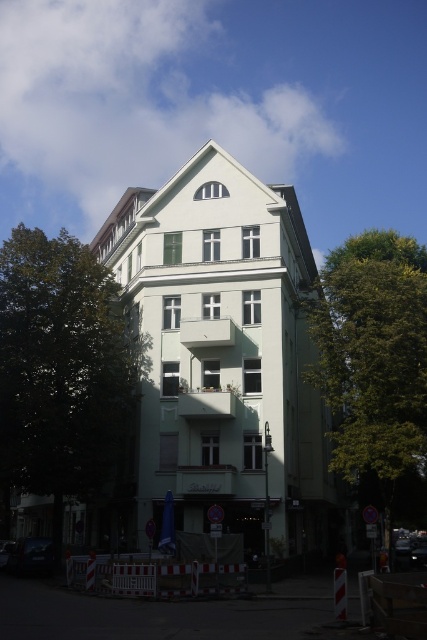
A worker needs to move a ladder from the green leafy tree at left to the construction area marked by red and white barriers. The ladder is 5 meters long. Will the ladder reach the construction area from the tree?

The distance between the green leafy tree at left and the construction area marked by red and white barriers is 56.73 meters. Since the ladder is only 5 meters long, it will not be long enough to reach the construction area from the tree.

You are a delivery person with a 1.5 meter wide delivery truck. You need to drive through the space between the green leafy tree at left and the green leafy tree at center. Can your truck fit through the space between them?

The distance between the green leafy tree at left and the green leafy tree at center is 20.01 meters, which is much wider than the truck. The truck can easily pass through the space between them.

You are a city planner assessing a street with two green leafy trees. The trees are labeled as the green leafy tree at left and the green leafy tree at center. Based on the scene description, which tree would cast a longer shadow during midday when the sun is directly overhead?

The green leafy tree at left is larger in size than the green leafy tree at center, so it would cast a longer shadow during midday when the sun is directly overhead.